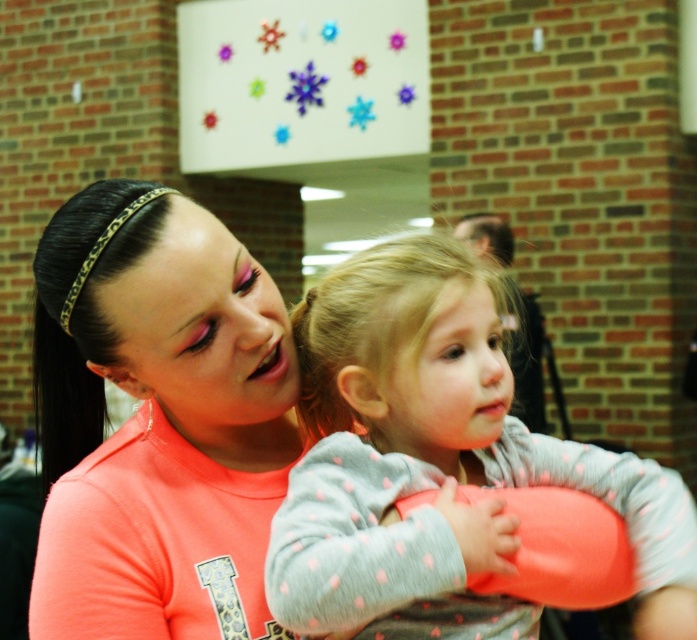
Between neon orange t-shirt at center and gray dotted sweater at center, which one has more height?

neon orange t-shirt at center

Is point (123, 308) in front of point (351, 296)?

Yes, it is.

Locate an element on the screen. Image resolution: width=697 pixels, height=640 pixels. neon orange t-shirt at center is located at coordinates (158, 422).